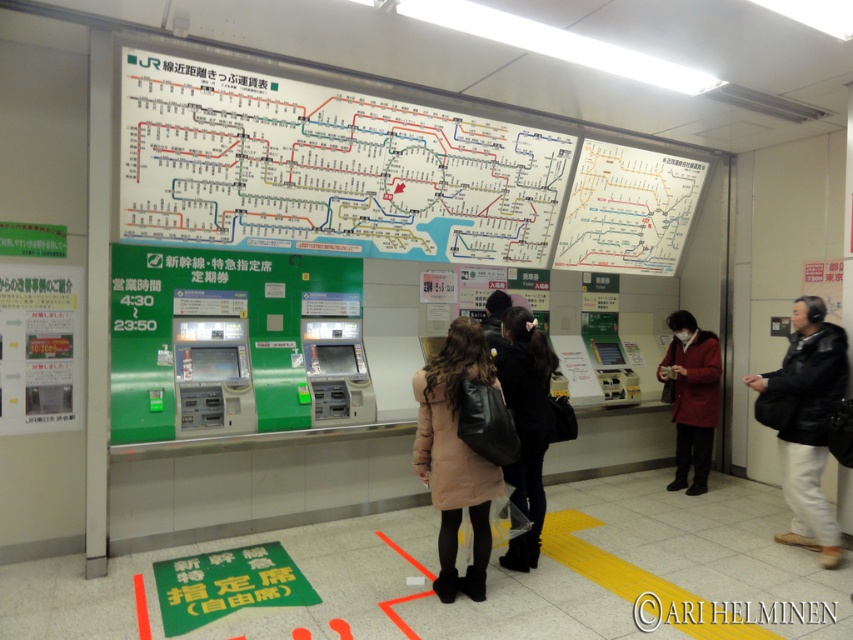
Looking at this image, you are a traveler in a Japanese train station and you need to buy a ticket. You see a red wool coat at right and a matte black jacket at center. Which clothing item is closer to the ticket vending machines?

The red wool coat at right is taller than matte black jacket at center, but their proximity to the ticket vending machines cannot be determined based on height alone. The description only provides information about their height, not their distance from the machines.

You are a traveler standing in the ticketing area and need to reach the black leather jacket at right to ask for directions. The white paper map at upper center is blocking your path. Can you walk around it? Explain why.

The white paper map at upper center is 2.58 meters away from the black leather jacket at right. Since the distance between them is over 2 meters, you can easily walk around the white paper map at upper center to reach the black leather jacket at right.

You are at the train station and need to reach the ticket vending machines. You are currently at point [712,426]. There is an obstacle at point [480,324]. Can you go around the obstacle to reach the machines?

Point [712,426] is behind point [480,324], so you can go around the obstacle at point [480,324] by moving to either side to reach the ticket vending machines.